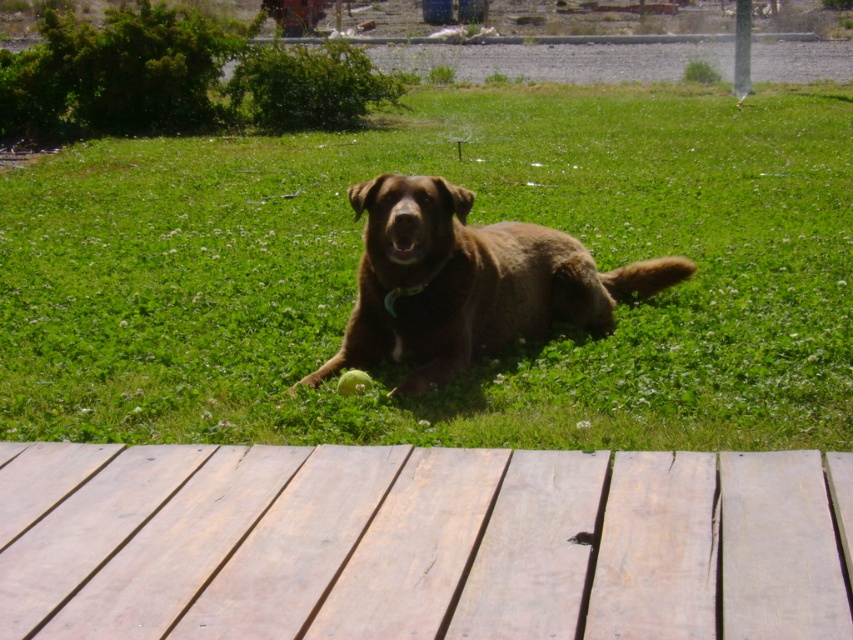
You are a gardener who wants to place a new flower pot between the light brown wooden deck at lower center and the brown furry dog at center. Considering their widths, which object should you place the flower pot closer to to ensure it fits?

The light brown wooden deck at lower center is wider than the brown furry dog at center. Therefore, placing the flower pot closer to the light brown wooden deck at lower center would provide more space for the pot to fit comfortably.

You are standing at the edge of the wooden deck and want to toss a ball to the brown furry dog at center. Since the green grass at center is between you and the dog, will the ball have to go over the grass to reach the dog?

The green grass at center is to the left of the brown furry dog at center, so the ball would need to go past the grass to reach the dog.

You are standing at the point labeled as point (53, 310) and want to throw a ball to a friend who is standing 5 meters away from you. Can you reach your friend by throwing the ball?

The distance between point (53, 310) and the viewer is 5.31 meters. Since your friend is 5 meters away, you can reach them by throwing the ball as 5.31 meters is greater than 5 meters.